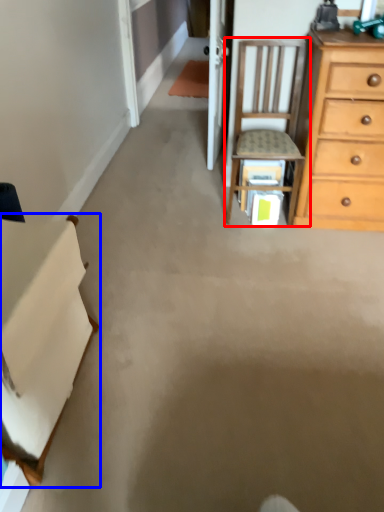
Question: Which point is closer to the camera, chair (highlighted by a red box) or cabinetry (highlighted by a blue box)?

Choices:
 (A) chair
 (B) cabinetry

Answer: (B)